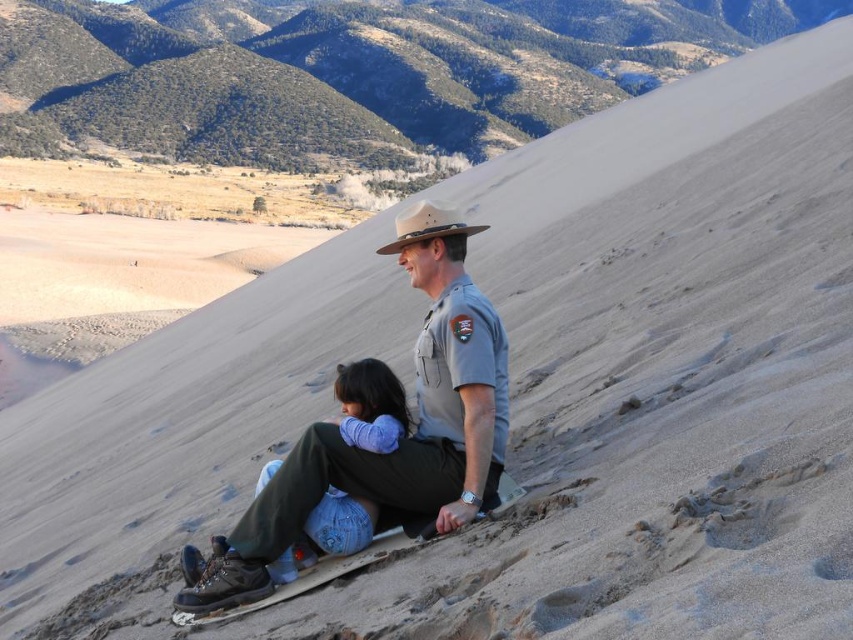
Question: Does gray uniform at center appear on the right side of light brown felt cowboy hat at center?

Choices:
 (A) no
 (B) yes

Answer: (B)

Question: Based on their relative distances, which object is farther from the gray uniform at center?

Choices:
 (A) denim pants at lower center
 (B) light brown felt cowboy hat at center

Answer: (B)

Question: Which object is closer to the camera taking this photo?

Choices:
 (A) denim pants at lower center
 (B) gray uniform at center
 (C) light brown felt cowboy hat at center

Answer: (A)

Question: Considering the relative positions of gray uniform at center and denim pants at lower center in the image provided, where is gray uniform at center located with respect to denim pants at lower center?

Choices:
 (A) below
 (B) above

Answer: (B)

Question: Among these objects, which one is farthest from the camera?

Choices:
 (A) denim pants at lower center
 (B) gray uniform at center

Answer: (B)

Question: Does denim pants at lower center have a lesser width compared to light brown felt cowboy hat at center?

Choices:
 (A) yes
 (B) no

Answer: (A)